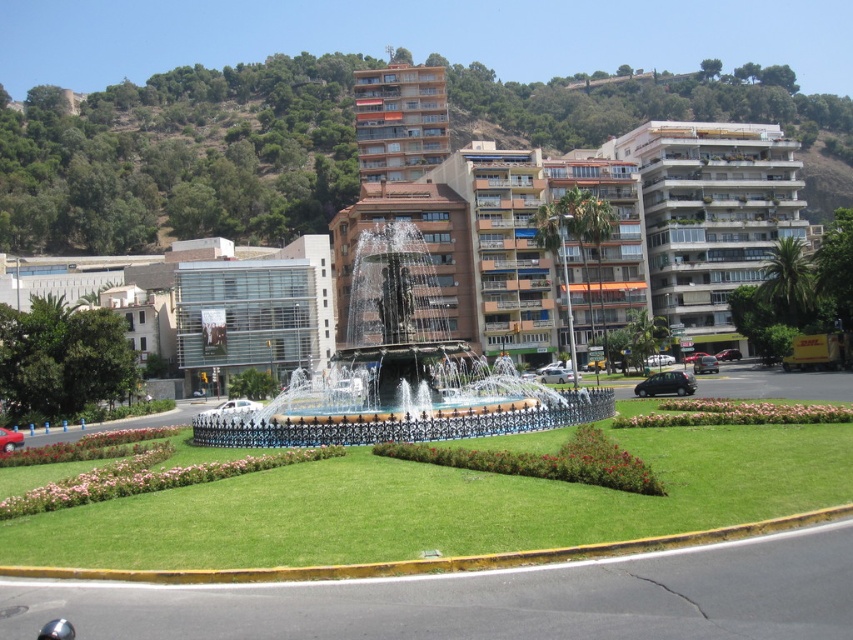
You are a city planner assessing the space between the black stone fountain at center and the white glossy building at upper right. Based on their widths, can a 2.5 meter wide truck pass through the space between them?

The black stone fountain at center is thinner than the white glossy building at upper right, but the exact width difference isn not specified. Without knowing the actual widths, it is impossible to determine if a 2.5 meter wide truck can pass through the space between them.

You are standing in the public square looking at the fountain. You notice two points marked in the image. Which point, point (x=213, y=432) or point (x=386, y=120), is closer to you?

Point (x=213, y=432) is closer to you than point (x=386, y=120).

You are standing at the entrance of the public square and want to locate the black stone fountain at center. According to the coordinates provided, which area should you head towards?

The black stone fountain at center is located at coordinates point (399, 372), so you should head towards the central area of the square.